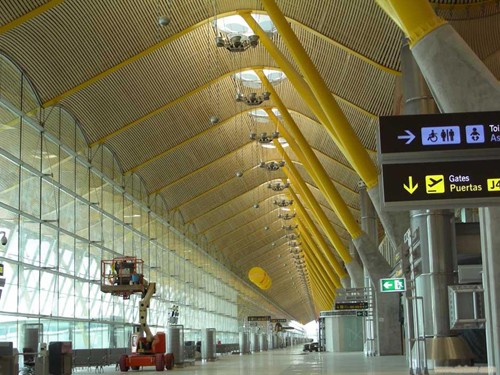
Locate an element on the screen. The height and width of the screenshot is (375, 500). puertas is located at coordinates (472, 191).